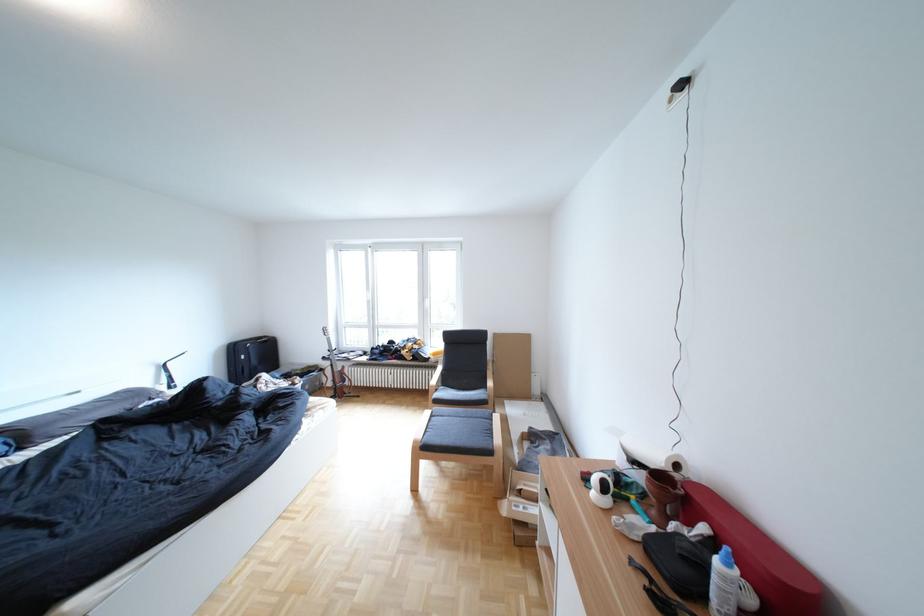
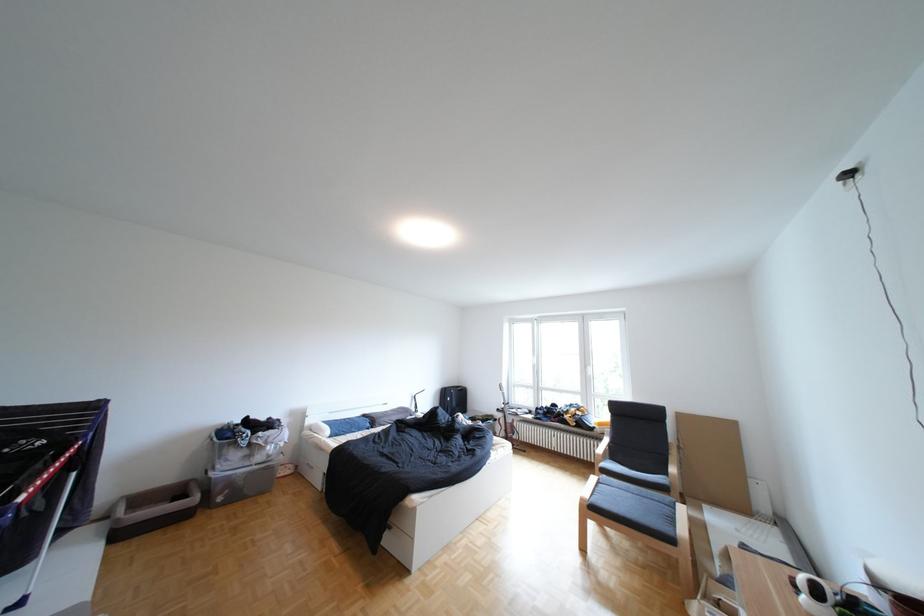
Where in the second image is the point corresponding to point (249, 349) from the first image?

(459, 392)